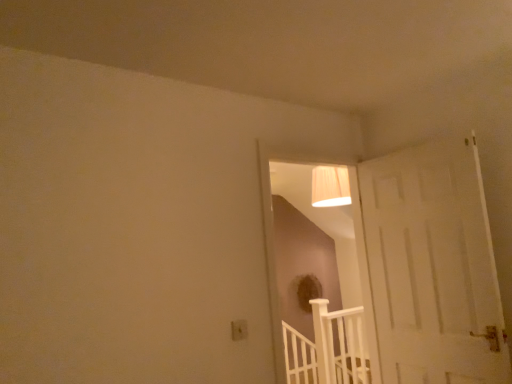
Question: Is point (245, 322) positioned closer to the camera than point (294, 377)?

Choices:
 (A) farther
 (B) closer

Answer: (B)

Question: From a real-world perspective, is white plastic electric outlet at lower center physically located above or below white wooden rail at lower center?

Choices:
 (A) above
 (B) below

Answer: (A)

Question: From the image's perspective, is white plastic electric outlet at lower center located above or below white wooden rail at lower center?

Choices:
 (A) above
 (B) below

Answer: (A)

Question: Is point (315, 382) positioned closer to the camera than point (236, 334)?

Choices:
 (A) closer
 (B) farther

Answer: (B)

Question: Considering the relative positions of white wooden rail at lower center and white plastic electric outlet at lower center in the image provided, is white wooden rail at lower center to the left or to the right of white plastic electric outlet at lower center?

Choices:
 (A) right
 (B) left

Answer: (A)

Question: From a real-world perspective, is white wooden rail at lower center positioned above or below white plastic electric outlet at lower center?

Choices:
 (A) below
 (B) above

Answer: (A)

Question: Is white wooden rail at lower center spatially inside white plastic electric outlet at lower center, or outside of it?

Choices:
 (A) inside
 (B) outside

Answer: (B)